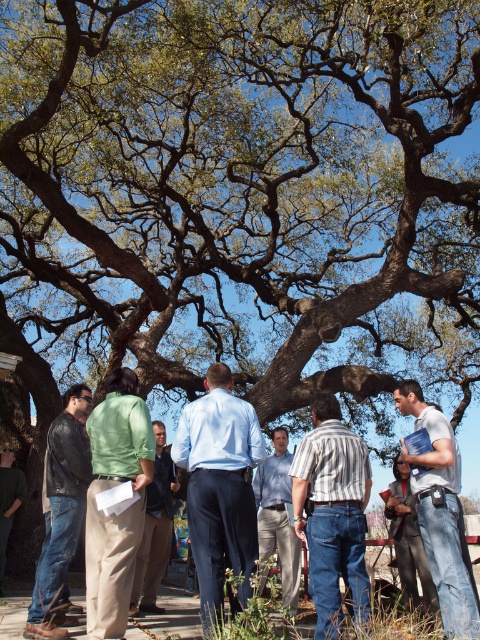
Between striped cotton shirt at center and blue shirt at center, which one appears on the left side from the viewer's perspective?

blue shirt at center is more to the left.

I want to click on striped cotton shirt at center, so click(333, 513).

The width and height of the screenshot is (480, 640). What are the coordinates of `striped cotton shirt at center` in the screenshot? It's located at (333, 513).

Measure the distance between green matte shirt at center and blue shirt at center.

The distance of green matte shirt at center from blue shirt at center is 3.09 meters.

Image resolution: width=480 pixels, height=640 pixels. What do you see at coordinates (113, 513) in the screenshot?
I see `green matte shirt at center` at bounding box center [113, 513].

The height and width of the screenshot is (640, 480). Find the location of `green matte shirt at center`. green matte shirt at center is located at coordinates (113, 513).

Can you confirm if matte black jacket at left is shorter than green cotton shirt at center?

Yes.

Is point (49, 515) in front of point (158, 605)?

That is True.

Locate an element on the screen. Image resolution: width=480 pixels, height=640 pixels. matte black jacket at left is located at coordinates (61, 513).